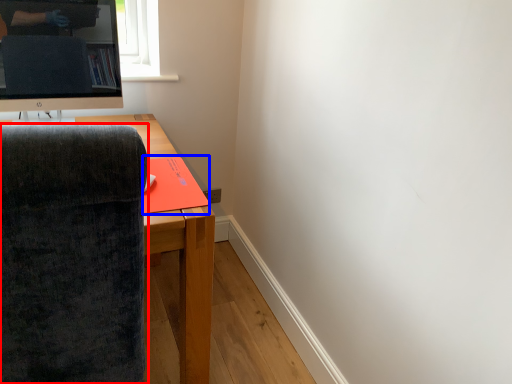
Question: Which object is further to the camera taking this photo, chair (highlighted by a red box) or book (highlighted by a blue box)?

Choices:
 (A) chair
 (B) book

Answer: (B)